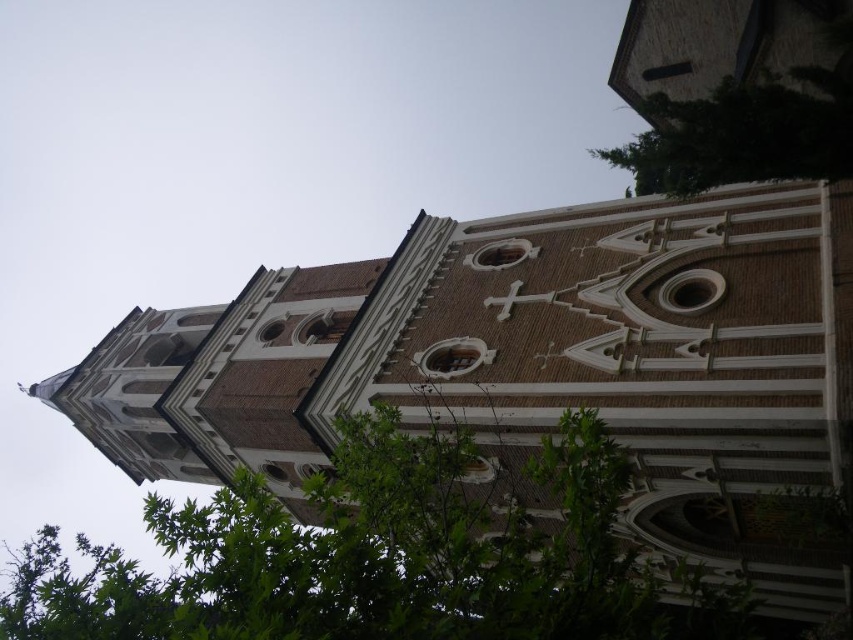
I want to click on green leafy tree at lower left, so click(x=381, y=557).

Is green leafy tree at lower left further to camera compared to green leafy tree at upper right?

No, it is in front of green leafy tree at upper right.

Locate an element on the screen. The width and height of the screenshot is (853, 640). green leafy tree at lower left is located at coordinates (381, 557).

The width and height of the screenshot is (853, 640). Find the location of `green leafy tree at lower left`. green leafy tree at lower left is located at coordinates (381, 557).